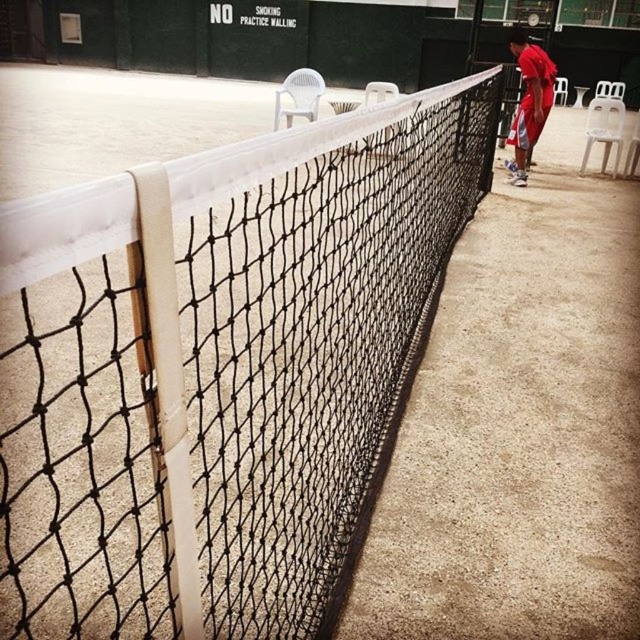
Is black mesh net at center to the left of red matte shirt at right from the viewer's perspective?

Yes, black mesh net at center is to the left of red matte shirt at right.

Between point (97, 564) and point (536, 54), which one is positioned behind?

Positioned behind is point (536, 54).

You are a GUI agent. You are given a task and a screenshot of the screen. Output one action in this format:
    pyautogui.click(x=<x>, y=<y>)
    Task: Click on the black mesh net at center
    The width and height of the screenshot is (640, 640).
    Given the screenshot: What is the action you would take?
    pyautogui.click(x=220, y=369)